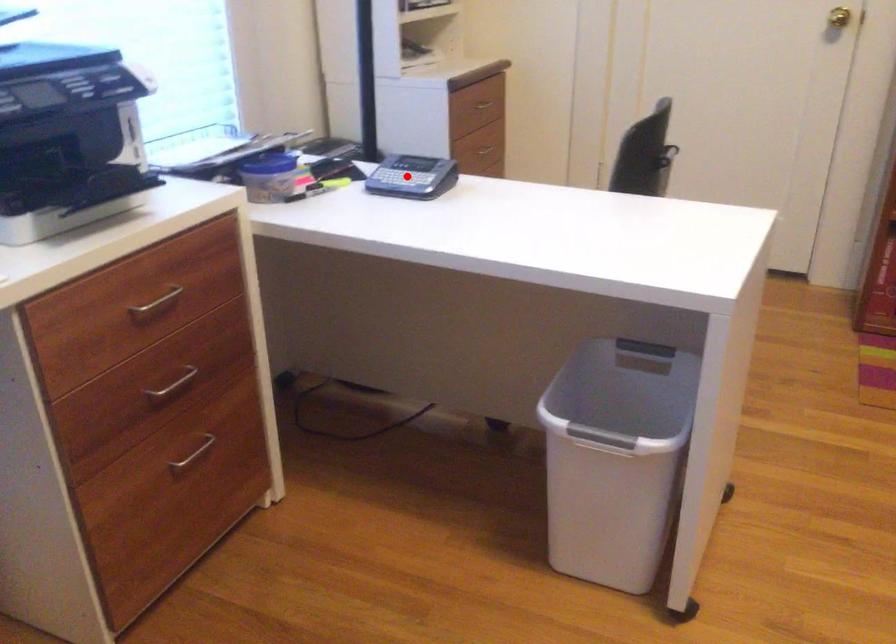
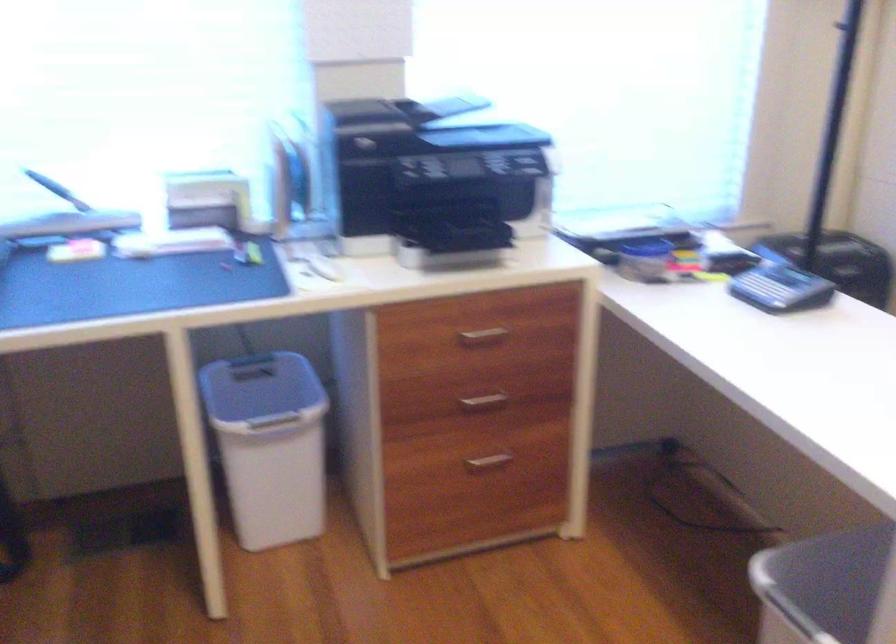
In the second image, find the point that corresponds to the highlighted location in the first image.

(763, 289)